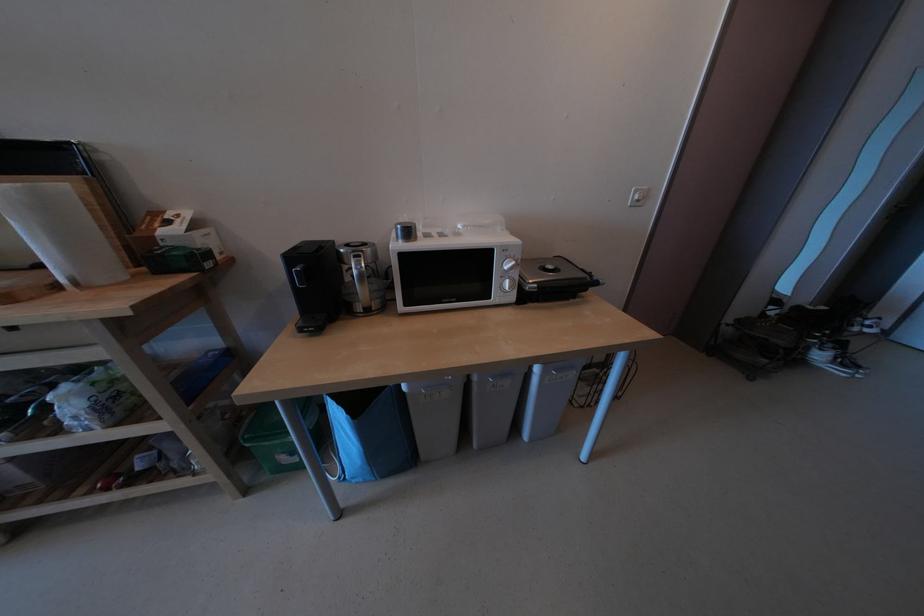
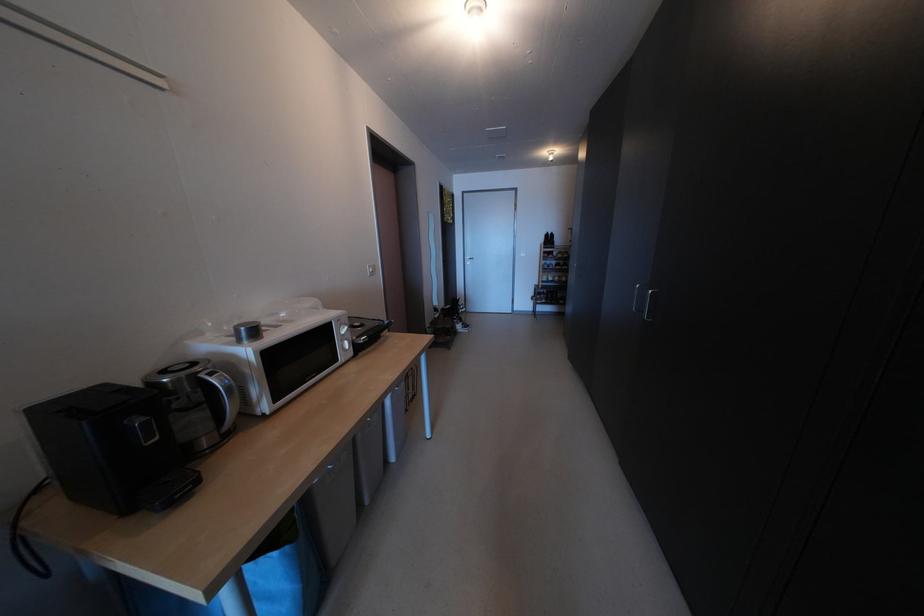
The point at (532, 262) is marked in the first image. Where is the corresponding point in the second image?

(360, 328)